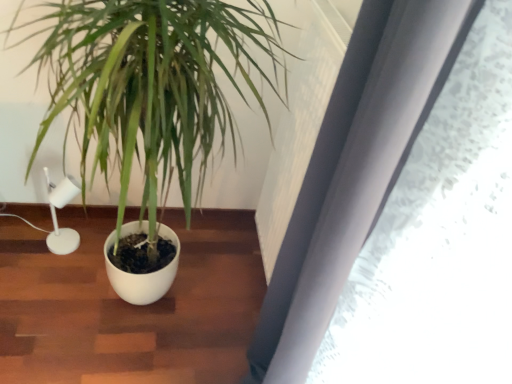
Question: Can you confirm if green matte plant at center is bigger than white matte lamp at left?

Choices:
 (A) no
 (B) yes

Answer: (B)

Question: From a real-world perspective, is green matte plant at center on top of white matte lamp at left?

Choices:
 (A) no
 (B) yes

Answer: (B)

Question: Considering the relative positions of green matte plant at center and white matte lamp at left in the image provided, is green matte plant at center to the right of white matte lamp at left from the viewer's perspective?

Choices:
 (A) yes
 (B) no

Answer: (A)

Question: Is green matte plant at center oriented away from white matte lamp at left?

Choices:
 (A) yes
 (B) no

Answer: (B)

Question: Is green matte plant at center closer to camera compared to white matte lamp at left?

Choices:
 (A) yes
 (B) no

Answer: (A)

Question: Is the position of green matte plant at center more distant than that of white matte lamp at left?

Choices:
 (A) no
 (B) yes

Answer: (A)

Question: Would you consider white matte lamp at left to be distant from green matte plant at center?

Choices:
 (A) yes
 (B) no

Answer: (B)

Question: Does white matte lamp at left have a smaller size compared to green matte plant at center?

Choices:
 (A) no
 (B) yes

Answer: (B)

Question: Is the position of white matte lamp at left less distant than that of green matte plant at center?

Choices:
 (A) yes
 (B) no

Answer: (B)

Question: Considering the relative sizes of white matte lamp at left and green matte plant at center in the image provided, is white matte lamp at left wider than green matte plant at center?

Choices:
 (A) no
 (B) yes

Answer: (A)

Question: Considering the relative sizes of white matte lamp at left and green matte plant at center in the image provided, is white matte lamp at left thinner than green matte plant at center?

Choices:
 (A) yes
 (B) no

Answer: (A)

Question: Is white matte lamp at left bigger than green matte plant at center?

Choices:
 (A) yes
 (B) no

Answer: (B)

Question: Choose the correct answer: Is white matte lamp at left inside green matte plant at center or outside it?

Choices:
 (A) outside
 (B) inside

Answer: (B)